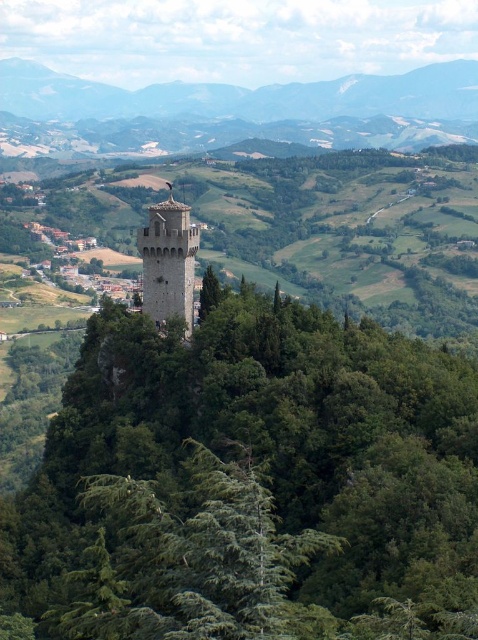
Is green leafy tree at center behind stone tower at center?

No, green leafy tree at center is in front of stone tower at center.

Does green leafy tree at center have a greater height compared to stone tower at center?

Yes.

Between point (187, 552) and point (149, 310), which one is positioned behind?

Positioned behind is point (149, 310).

Find the location of a particular element. green leafy tree at center is located at coordinates (249, 483).

Is point (413, 99) closer to viewer compared to point (172, 314)?

No, it is not.

Does point (401, 100) come behind point (173, 243)?

Yes, it is.

The width and height of the screenshot is (478, 640). In order to click on smooth gray mountain at upper center in this screenshot , I will do `click(245, 97)`.

Can you confirm if green leafy tree at center is positioned to the left of smooth gray mountain at upper center?

In fact, green leafy tree at center is to the right of smooth gray mountain at upper center.

Does green leafy tree at center appear over smooth gray mountain at upper center?

Actually, green leafy tree at center is below smooth gray mountain at upper center.

The image size is (478, 640). What do you see at coordinates (249, 483) in the screenshot?
I see `green leafy tree at center` at bounding box center [249, 483].

Where is `green leafy tree at center`? The image size is (478, 640). green leafy tree at center is located at coordinates (249, 483).